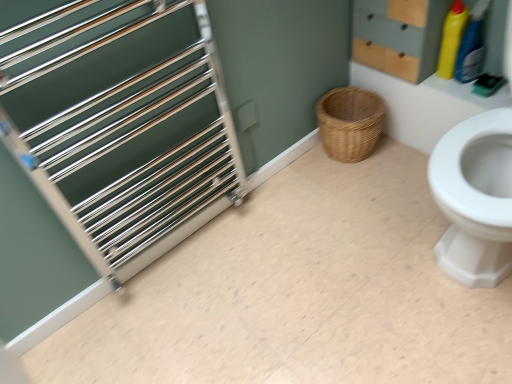
Image resolution: width=512 pixels, height=384 pixels. Describe the element at coordinates (451, 39) in the screenshot. I see `yellow plastic bottle at upper right, placed as the second cleaning product when sorted from right to left` at that location.

Where is `yellow plastic bottle at upper right, placed as the second cleaning product when sorted from right to left`? The width and height of the screenshot is (512, 384). yellow plastic bottle at upper right, placed as the second cleaning product when sorted from right to left is located at coordinates (451, 39).

What do you see at coordinates (124, 127) in the screenshot? I see `polished metal rack at left` at bounding box center [124, 127].

Locate an element on the screen. Image resolution: width=512 pixels, height=384 pixels. yellow plastic bottle at upper right, the 1th cleaning product when ordered from right to left is located at coordinates (472, 45).

Are woven natural basket at lower center and brushed metal towel rack at left beside each other?

woven natural basket at lower center is not next to brushed metal towel rack at left, and they're not touching.

From the image's perspective, is woven natural basket at lower center located beneath brushed metal towel rack at left?

No, from the image's perspective, woven natural basket at lower center is not beneath brushed metal towel rack at left.

Between woven natural basket at lower center and brushed metal towel rack at left, which one has larger size?

Bigger between the two is brushed metal towel rack at left.

How many degrees apart are the facing directions of woven natural basket at lower center and brushed metal towel rack at left?

The angular difference between woven natural basket at lower center and brushed metal towel rack at left is 180 degrees.

From the image's perspective, does brushed metal towel rack at left appear higher than polished metal rack at left?

No, from the image's perspective, brushed metal towel rack at left is not over polished metal rack at left.

How far apart are brushed metal towel rack at left and polished metal rack at left?

A distance of 18.26 inches exists between brushed metal towel rack at left and polished metal rack at left.

At what (x,y) coordinates should I click in order to perform the action: click on plain below the polished metal rack at left (from a real-world perspective). Please return your answer as a coordinate pair (x, y). The height and width of the screenshot is (384, 512). Looking at the image, I should click on (298, 293).

How many degrees apart are the facing directions of brushed metal towel rack at left and polished metal rack at left?

89.7 degrees separate the facing orientations of brushed metal towel rack at left and polished metal rack at left.

Can you confirm if polished metal rack at left is positioned to the right of yellow plastic bottle at upper right, arranged as the second cleaning product when viewed from the left?

No.

Is the surface of polished metal rack at left in direct contact with yellow plastic bottle at upper right, the 1th cleaning product when ordered from right to left?

polished metal rack at left is not next to yellow plastic bottle at upper right, the 1th cleaning product when ordered from right to left, and they're not touching.

Considering the relative sizes of polished metal rack at left and yellow plastic bottle at upper right, the 1th cleaning product when ordered from right to left, in the image provided, is polished metal rack at left bigger than yellow plastic bottle at upper right, the 1th cleaning product when ordered from right to left,?

Yes.

What's the angular difference between brushed metal towel rack at left and yellow plastic bottle at upper right, placed as the second cleaning product when sorted from right to left,'s facing directions?

The angular difference between brushed metal towel rack at left and yellow plastic bottle at upper right, placed as the second cleaning product when sorted from right to left, is 180 degrees.

Considering the relative positions of brushed metal towel rack at left and yellow plastic bottle at upper right, which is the first cleaning product from left to right, in the image provided, is brushed metal towel rack at left to the right of yellow plastic bottle at upper right, which is the first cleaning product from left to right, from the viewer's perspective?

Incorrect, brushed metal towel rack at left is not on the right side of yellow plastic bottle at upper right, which is the first cleaning product from left to right.

From the image's perspective, is brushed metal towel rack at left located beneath yellow plastic bottle at upper right, placed as the second cleaning product when sorted from right to left?

Yes.

From the picture: Considering the positions of objects brushed metal towel rack at left and yellow plastic bottle at upper right, placed as the second cleaning product when sorted from right to left, in the image provided, who is behind, brushed metal towel rack at left or yellow plastic bottle at upper right, placed as the second cleaning product when sorted from right to left,?

yellow plastic bottle at upper right, placed as the second cleaning product when sorted from right to left.

Which point is more distant from viewer, (359, 129) or (410, 0)?

The point (359, 129) is farther.

Is woven natural basket at lower center turned away from wooden drawer at upper right?

No.

Locate an element on the screen. The image size is (512, 384). basket on the left of the wooden drawer at upper right is located at coordinates (350, 123).

Considering the positions of objects woven natural basket at lower center and wooden drawer at upper right in the image provided, who is more to the left, woven natural basket at lower center or wooden drawer at upper right?

woven natural basket at lower center is more to the left.

Is yellow plastic bottle at upper right, which is the first cleaning product from left to right, smaller than wooden drawer at upper right?

Correct, yellow plastic bottle at upper right, which is the first cleaning product from left to right, occupies less space than wooden drawer at upper right.

How different are the orientations of yellow plastic bottle at upper right, which is the first cleaning product from left to right, and wooden drawer at upper right in degrees?

The angular difference between yellow plastic bottle at upper right, which is the first cleaning product from left to right, and wooden drawer at upper right is 1.24 degrees.

From a real-world perspective, relative to wooden drawer at upper right, is yellow plastic bottle at upper right, placed as the second cleaning product when sorted from right to left, vertically above or below?

yellow plastic bottle at upper right, placed as the second cleaning product when sorted from right to left, is situated lower than wooden drawer at upper right in the real world.

From the image's perspective, would you say yellow plastic bottle at upper right, placed as the second cleaning product when sorted from right to left, is shown under wooden drawer at upper right?

Indeed, from the image's perspective, yellow plastic bottle at upper right, placed as the second cleaning product when sorted from right to left, is shown beneath wooden drawer at upper right.

In the scene shown: Which object is thinner, polished metal rack at left or woven natural basket at lower center?

With smaller width is polished metal rack at left.

Can woven natural basket at lower center be found inside polished metal rack at left?

No, woven natural basket at lower center is not inside polished metal rack at left.

Is polished metal rack at left far away from woven natural basket at lower center?

They are positioned close to each other.

Which of these two, polished metal rack at left or woven natural basket at lower center, is bigger?

polished metal rack at left.

What are the coordinates of `basket on the right of brushed metal towel rack at left` in the screenshot? It's located at (350, 123).

Identify the location of cage behind the brushed metal towel rack at left. This screenshot has width=512, height=384. click(x=124, y=127).

Which object lies nearer to the anchor point yellow plastic bottle at upper right, the 1th cleaning product when ordered from right to left, woven natural basket at lower center or polished metal rack at left?

woven natural basket at lower center lies closer to yellow plastic bottle at upper right, the 1th cleaning product when ordered from right to left, than the other object.

Estimate the real-world distances between objects in this image. Which object is closer to woven natural basket at lower center, brushed metal towel rack at left or yellow plastic bottle at upper right, which is the first cleaning product from left to right?

The object closer to woven natural basket at lower center is yellow plastic bottle at upper right, which is the first cleaning product from left to right.

Which object lies further to the anchor point yellow plastic bottle at upper right, placed as the second cleaning product when sorted from right to left, brushed metal towel rack at left or woven natural basket at lower center?

brushed metal towel rack at left lies further to yellow plastic bottle at upper right, placed as the second cleaning product when sorted from right to left, than the other object.

Which object lies further to the anchor point yellow plastic bottle at upper right, arranged as the second cleaning product when viewed from the left, wooden drawer at upper right or brushed metal towel rack at left?

Based on the image, brushed metal towel rack at left appears to be further to yellow plastic bottle at upper right, arranged as the second cleaning product when viewed from the left.

Considering their positions, is brushed metal towel rack at left positioned further to wooden drawer at upper right than polished metal rack at left?

polished metal rack at left.

Looking at the image, which one is located further to yellow plastic bottle at upper right, the 1th cleaning product when ordered from right to left, yellow plastic bottle at upper right, placed as the second cleaning product when sorted from right to left, or brushed metal towel rack at left?

brushed metal towel rack at left.

Looking at the image, which one is located further to yellow plastic bottle at upper right, which is the first cleaning product from left to right, polished metal rack at left or yellow plastic bottle at upper right, arranged as the second cleaning product when viewed from the left?

Based on the image, polished metal rack at left appears to be further to yellow plastic bottle at upper right, which is the first cleaning product from left to right.

From the image, which object appears to be farther from polished metal rack at left, woven natural basket at lower center or yellow plastic bottle at upper right, placed as the second cleaning product when sorted from right to left?

Based on the image, yellow plastic bottle at upper right, placed as the second cleaning product when sorted from right to left, appears to be further to polished metal rack at left.

Locate an element on the screen. The height and width of the screenshot is (384, 512). cage between brushed metal towel rack at left and woven natural basket at lower center in the front-back direction is located at coordinates (124, 127).

This screenshot has width=512, height=384. In order to click on plain situated between polished metal rack at left and yellow plastic bottle at upper right, placed as the second cleaning product when sorted from right to left, from left to right in this screenshot , I will do (298, 293).

The height and width of the screenshot is (384, 512). I want to click on basket located between polished metal rack at left and yellow plastic bottle at upper right, which is the first cleaning product from left to right, in the left-right direction, so click(x=350, y=123).

Where is `basket between polished metal rack at left and wooden drawer at upper right from left to right`? This screenshot has height=384, width=512. basket between polished metal rack at left and wooden drawer at upper right from left to right is located at coordinates (350, 123).